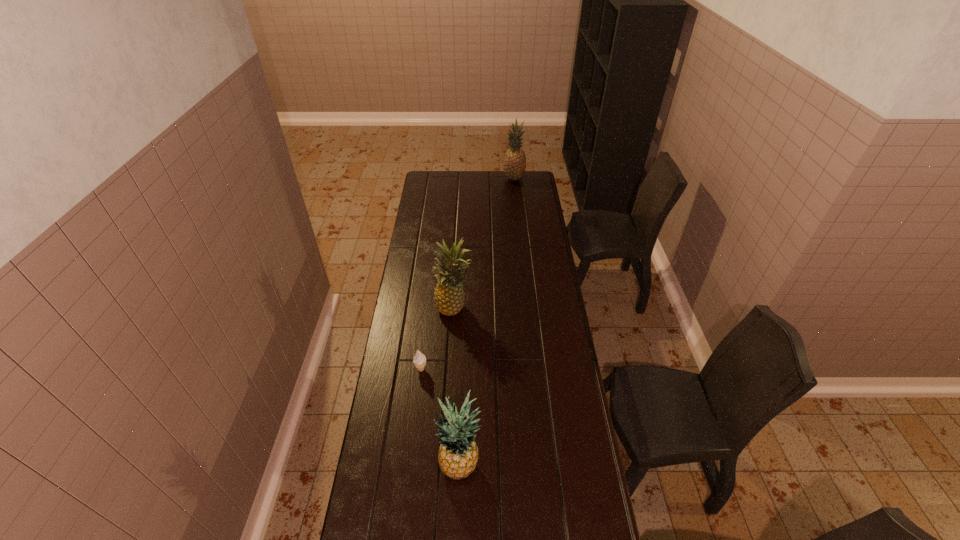
Point out which pineapple is positioned as the second nearest to the rightmost pineapple. Please provide its 2D coordinates. Your answer should be formatted as a tuple, i.e. [(x, y)], where the tuple contains the x and y coordinates of a point satisfying the conditions above.

[(458, 453)]

At what (x,y) coordinates should I click in order to perform the action: click on pineapple that is the second closest to the nearest object. Please return your answer as a coordinate pair (x, y). Looking at the image, I should click on (514, 165).

In order to click on vacant position in the image that satisfies the following two spatial constraints: 1. on the front-facing side of the nearest object; 2. on the right side of the third farthest object in this screenshot , I will do `click(410, 467)`.

Identify the location of vacant space that satisfies the following two spatial constraints: 1. on the front-facing side of the second nearest object; 2. on the right side of the nearest pineapple. (410, 467).

I want to click on free region that satisfies the following two spatial constraints: 1. on the front-facing side of the leftmost object; 2. on the left side of the nearest object, so click(410, 467).